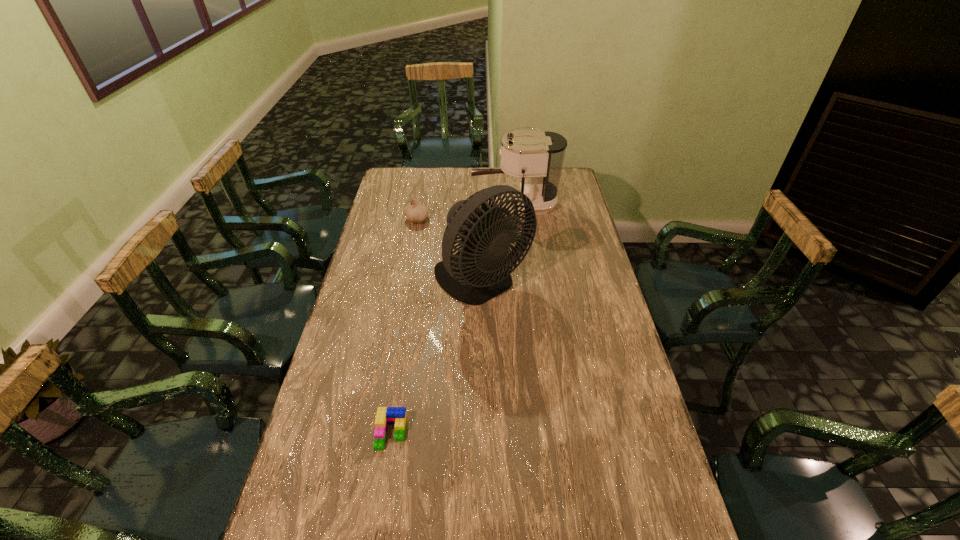
This screenshot has height=540, width=960. Find the location of `vacant space in between the second shortest object and the nearest object`. vacant space in between the second shortest object and the nearest object is located at coordinates pos(404,326).

In order to click on vacant point located between the nearest object and the coffee maker in this screenshot , I will do `click(453, 319)`.

This screenshot has width=960, height=540. I want to click on free space between the coffee maker and the nearest object, so click(453, 319).

Identify the location of empty space that is in between the tallest object and the shortest object. This screenshot has width=960, height=540. (437, 357).

The width and height of the screenshot is (960, 540). In order to click on object that is the second nearest to the tallest object in this screenshot , I will do `click(538, 155)`.

I want to click on the second closest object to the third tallest object, so tap(538, 155).

You are a GUI agent. You are given a task and a screenshot of the screen. Output one action in this format:
    pyautogui.click(x=<x>, y=<y>)
    Task: Click on the vacant space that satisfies the following two spatial constraints: 1. on the front-facing side of the third shortest object; 2. in front of the third farthest object to direct airflow
    Image resolution: width=960 pixels, height=540 pixels.
    Given the screenshot: What is the action you would take?
    pyautogui.click(x=523, y=282)

Locate an element on the screen. free spot that satisfies the following two spatial constraints: 1. on the front-facing side of the coffee maker; 2. on the front side of the third tallest object is located at coordinates (516, 220).

Where is `vacant space that satisfies the following two spatial constraints: 1. on the front-facing side of the second tallest object; 2. in front of the third farthest object to direct airflow`? This screenshot has width=960, height=540. vacant space that satisfies the following two spatial constraints: 1. on the front-facing side of the second tallest object; 2. in front of the third farthest object to direct airflow is located at coordinates (523, 282).